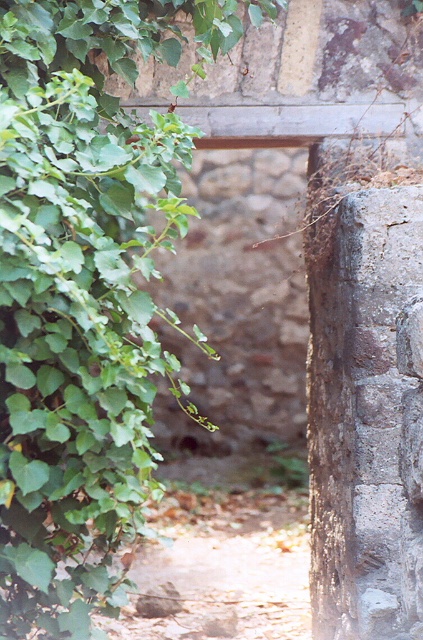
Between green leafy plant at left and brown dirt path at center, which one is positioned lower?

brown dirt path at center is below.

Who is shorter, green leafy plant at left or brown dirt path at center?

With less height is brown dirt path at center.

Does point (27, 374) come in front of point (211, 612)?

Yes, it is in front of point (211, 612).

The image size is (423, 640). Identify the location of green leafy plant at left. tap(85, 292).